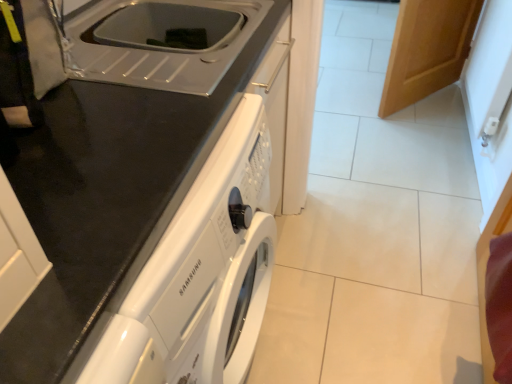
Question: Does white glossy washing machine at center appear on the right side of wooden door at upper right?

Choices:
 (A) no
 (B) yes

Answer: (A)

Question: Is white glossy washing machine at center further to camera compared to wooden door at upper right?

Choices:
 (A) no
 (B) yes

Answer: (A)

Question: Considering the relative sizes of white glossy washing machine at center and wooden door at upper right in the image provided, is white glossy washing machine at center bigger than wooden door at upper right?

Choices:
 (A) no
 (B) yes

Answer: (B)

Question: Does white glossy washing machine at center have a smaller size compared to wooden door at upper right?

Choices:
 (A) yes
 (B) no

Answer: (B)

Question: From a real-world perspective, does white glossy washing machine at center sit lower than wooden door at upper right?

Choices:
 (A) yes
 (B) no

Answer: (B)

Question: From the image's perspective, is wooden door at upper right located above or below white glossy washing machine at center?

Choices:
 (A) above
 (B) below

Answer: (A)

Question: In terms of size, does wooden door at upper right appear bigger or smaller than white glossy washing machine at center?

Choices:
 (A) big
 (B) small

Answer: (B)

Question: In terms of width, does wooden door at upper right look wider or thinner when compared to white glossy washing machine at center?

Choices:
 (A) thin
 (B) wide

Answer: (A)

Question: From a real-world perspective, is wooden door at upper right above or below white glossy washing machine at center?

Choices:
 (A) above
 (B) below

Answer: (B)

Question: Relative to white plastic sink at upper center, is white glossy washing machine at center in front or behind?

Choices:
 (A) behind
 (B) front

Answer: (B)

Question: Is white glossy washing machine at center spatially inside white plastic sink at upper center, or outside of it?

Choices:
 (A) outside
 (B) inside

Answer: (A)

Question: From a real-world perspective, is white glossy washing machine at center physically located above or below white plastic sink at upper center?

Choices:
 (A) above
 (B) below

Answer: (B)

Question: Looking at the image, does white glossy washing machine at center seem bigger or smaller compared to white plastic sink at upper center?

Choices:
 (A) big
 (B) small

Answer: (A)

Question: Considering the positions of white plastic sink at upper center and wooden door at upper right in the image, is white plastic sink at upper center wider or thinner than wooden door at upper right?

Choices:
 (A) wide
 (B) thin

Answer: (A)

Question: Would you say white plastic sink at upper center is to the left or to the right of wooden door at upper right in the picture?

Choices:
 (A) right
 (B) left

Answer: (B)